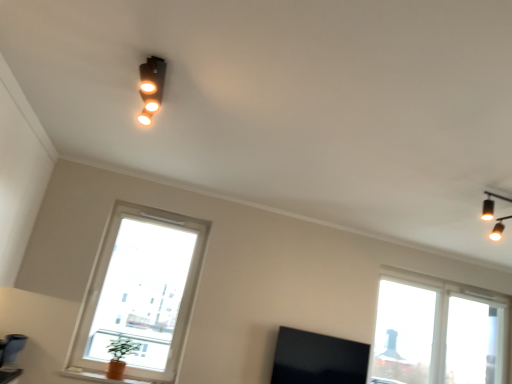
Question: Does point (159, 92) appear closer or farther from the camera than point (110, 345)?

Choices:
 (A) farther
 (B) closer

Answer: (B)

Question: Considering the positions of matte black spotlight at upper center and green leafy plant at lower left in the image, is matte black spotlight at upper center wider or thinner than green leafy plant at lower left?

Choices:
 (A) wide
 (B) thin

Answer: (B)

Question: Which object is the closest to the matte orange vase at lower left?

Choices:
 (A) transparent glass window at right, marked as the second window in a left-to-right arrangement
 (B) green leafy plant at lower left
 (C) black matte tv at lower center
 (D) matte black spotlight at upper center
 (E) transparent glass window at lower left, the second window in the back-to-front sequence

Answer: (B)

Question: Estimate the real-world distances between objects in this image. Which object is farther from the black matte tv at lower center?

Choices:
 (A) matte black spotlight at upper center
 (B) transparent glass window at right, marked as the second window in a left-to-right arrangement
 (C) green leafy plant at lower left
 (D) matte orange vase at lower left
 (E) white plastic window frame at right

Answer: (A)